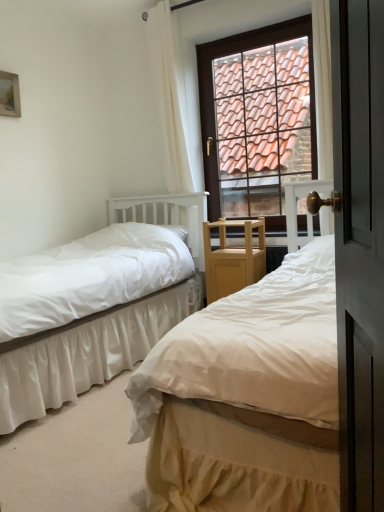
Question: Considering the relative positions of brown tile roof at upper center and white cotton bed at center, arranged as the 1th bed when viewed from the right, in the image provided, is brown tile roof at upper center in front of white cotton bed at center, arranged as the 1th bed when viewed from the right,?

Choices:
 (A) yes
 (B) no

Answer: (B)

Question: Is brown tile roof at upper center touching white cotton bed at center, arranged as the 1th bed when viewed from the right?

Choices:
 (A) yes
 (B) no

Answer: (B)

Question: Is brown tile roof at upper center surrounding white cotton bed at center, which ranks as the 2th bed in left-to-right order?

Choices:
 (A) no
 (B) yes

Answer: (A)

Question: Does brown tile roof at upper center appear on the right side of white cotton bed at center, which ranks as the 2th bed in left-to-right order?

Choices:
 (A) no
 (B) yes

Answer: (B)

Question: From the image's perspective, would you say brown tile roof at upper center is positioned over white cotton bed at center, arranged as the 1th bed when viewed from the right?

Choices:
 (A) no
 (B) yes

Answer: (B)

Question: Does brown tile roof at upper center appear on the left side of white cotton bed at center, which ranks as the 2th bed in left-to-right order?

Choices:
 (A) no
 (B) yes

Answer: (A)

Question: Is white satin bed at center, which is counted as the second bed, starting from the right, at the left side of matte white screen door at right?

Choices:
 (A) yes
 (B) no

Answer: (A)

Question: Is white satin bed at center, which is counted as the second bed, starting from the right, not within matte white screen door at right?

Choices:
 (A) no
 (B) yes

Answer: (B)

Question: Does white satin bed at center, which is the first bed from left to right, turn towards matte white screen door at right?

Choices:
 (A) no
 (B) yes

Answer: (B)

Question: Considering the relative sizes of white satin bed at center, which is the first bed from left to right, and matte white screen door at right in the image provided, is white satin bed at center, which is the first bed from left to right, thinner than matte white screen door at right?

Choices:
 (A) yes
 (B) no

Answer: (B)

Question: Can matte white screen door at right be found inside white satin bed at center, which is the first bed from left to right?

Choices:
 (A) no
 (B) yes

Answer: (A)

Question: Can you confirm if white satin bed at center, which is the first bed from left to right, is positioned to the right of matte white screen door at right?

Choices:
 (A) no
 (B) yes

Answer: (A)

Question: Is wooden picture frame at upper left far from white satin bed at center, which is counted as the second bed, starting from the right?

Choices:
 (A) yes
 (B) no

Answer: (A)